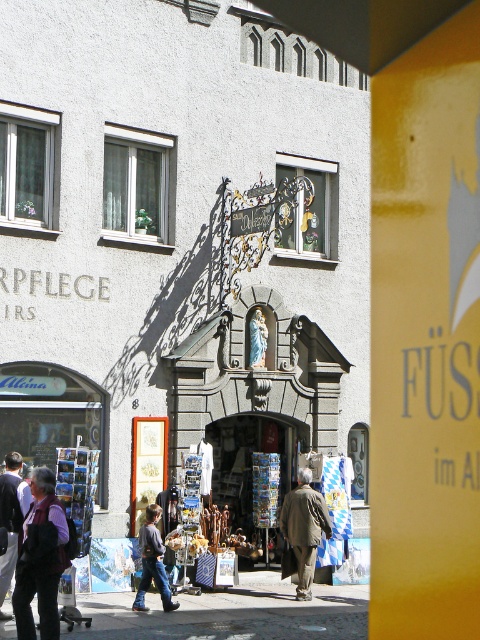
Question: Based on their relative distances, which object is farther from the brown leather jacket at center?

Choices:
 (A) matte gray building at center
 (B) dark purple shirt at lower left
 (C) denim jeans at lower center
 (D) dark brown leather jacket at lower left

Answer: (B)

Question: Can you confirm if dark purple shirt at lower left is smaller than brown leather jacket at center?

Choices:
 (A) no
 (B) yes

Answer: (B)

Question: Which point is closer to the camera?

Choices:
 (A) pos(294,496)
 (B) pos(48,483)
 (C) pos(9,540)
 (D) pos(156,534)

Answer: (B)

Question: Is matte gray building at center to the left of dark purple shirt at lower left from the viewer's perspective?

Choices:
 (A) yes
 (B) no

Answer: (B)

Question: Which point appears closest to the camera in this image?

Choices:
 (A) (160, 588)
 (B) (233, 484)
 (C) (24, 522)
 (D) (10, 472)

Answer: (C)

Question: Is dark purple shirt at lower left thinner than brown leather jacket at center?

Choices:
 (A) no
 (B) yes

Answer: (B)